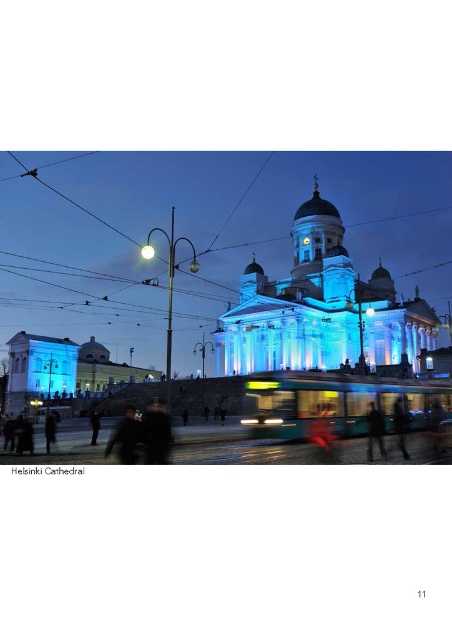
Question: Can you confirm if illuminated stone cathedral at center is wider than light blue stone church at center?

Choices:
 (A) yes
 (B) no

Answer: (A)

Question: Among these objects, which one is farthest from the camera?

Choices:
 (A) dark fabric jacket at center
 (B) illuminated stone cathedral at center

Answer: (B)

Question: Can you confirm if illuminated stone cathedral at center is wider than light blue stone church at center?

Choices:
 (A) yes
 (B) no

Answer: (A)

Question: From the image, what is the correct spatial relationship of illuminated stone cathedral at center in relation to dark fabric jacket at center?

Choices:
 (A) left
 (B) right

Answer: (A)

Question: Which object is the farthest from the dark fabric jacket at center?

Choices:
 (A) illuminated stone cathedral at center
 (B) light blue stone church at center

Answer: (A)

Question: Which point appears closest to the camera in this image?

Choices:
 (A) (366, 321)
 (B) (197, 284)
 (C) (371, 442)

Answer: (C)